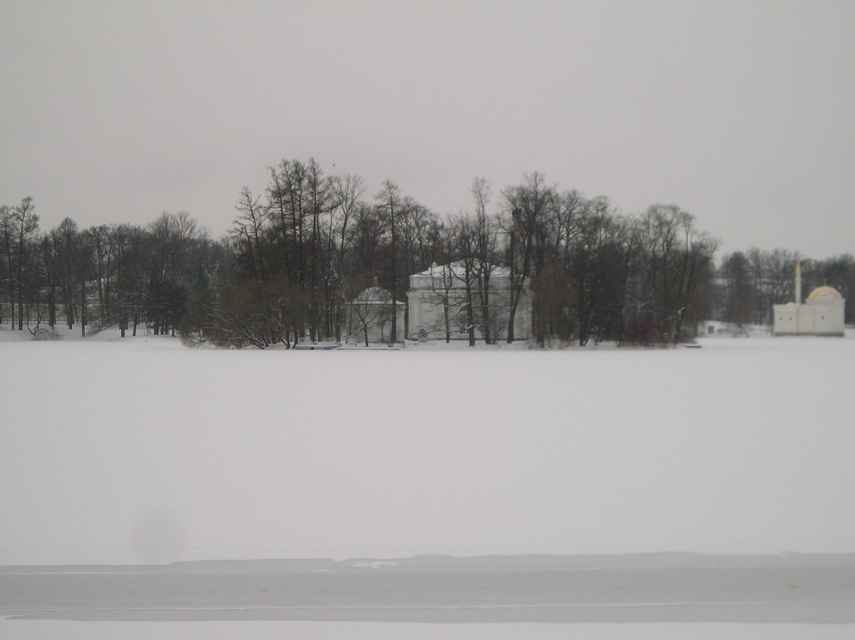
Question: Can you confirm if white matte snow at center is bigger than brown leafless tree at center?

Choices:
 (A) no
 (B) yes

Answer: (A)

Question: Can you confirm if white matte snow at center is smaller than brown leafless tree at center?

Choices:
 (A) no
 (B) yes

Answer: (B)

Question: Among these objects, which one is nearest to the camera?

Choices:
 (A) brown leafless tree at center
 (B) white matte snow at center

Answer: (B)

Question: Among these points, which one is farthest from the camera?

Choices:
 (A) (116, 305)
 (B) (388, 472)

Answer: (A)

Question: In this image, where is white matte snow at center located relative to brown leafless tree at center?

Choices:
 (A) left
 (B) right

Answer: (A)

Question: Which object is closer to the camera taking this photo?

Choices:
 (A) brown leafless tree at center
 (B) white matte snow at center

Answer: (B)